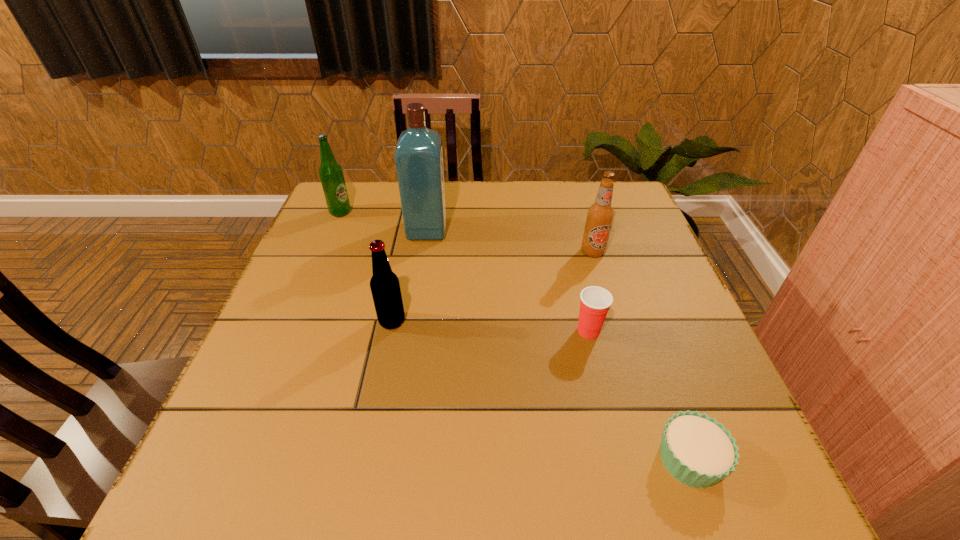
Identify the location of object that ranks as the second closest to the rightmost beer bottle. The height and width of the screenshot is (540, 960). (419, 153).

Locate which beer bottle ranks second in proximity to the rightmost beer bottle. Please provide its 2D coordinates. Your answer should be formatted as a tuple, i.e. [(x, y)], where the tuple contains the x and y coordinates of a point satisfying the conditions above.

[(331, 175)]

Choose which beer bottle is the second nearest neighbor to the cupcake. Please provide its 2D coordinates. Your answer should be formatted as a tuple, i.e. [(x, y)], where the tuple contains the x and y coordinates of a point satisfying the conditions above.

[(385, 288)]

The width and height of the screenshot is (960, 540). Identify the location of free region that satisfies the following two spatial constraints: 1. on the back side of the nearest object; 2. on the flat label side of the tallest object. 607,230.

This screenshot has width=960, height=540. Find the location of `free spot that satisfies the following two spatial constraints: 1. on the label of the farthest beer bottle; 2. on the right side of the nearest object`. free spot that satisfies the following two spatial constraints: 1. on the label of the farthest beer bottle; 2. on the right side of the nearest object is located at coordinates (237, 459).

Find the location of a particular element. The width and height of the screenshot is (960, 540). vacant area in the image that satisfies the following two spatial constraints: 1. on the flat label side of the tallest object; 2. on the back side of the Dixie cup is located at coordinates (412, 331).

I want to click on vacant space that satisfies the following two spatial constraints: 1. on the label of the cupcake; 2. on the left side of the farthest object, so click(237, 459).

Where is `vacant area that satisfies the following two spatial constraints: 1. on the front side of the nearest object; 2. on the left side of the nearest beer bottle`? This screenshot has width=960, height=540. vacant area that satisfies the following two spatial constraints: 1. on the front side of the nearest object; 2. on the left side of the nearest beer bottle is located at coordinates (365, 459).

The image size is (960, 540). Find the location of `vacant area that satisfies the following two spatial constraints: 1. on the label of the shortest object; 2. on the right side of the leftmost object`. vacant area that satisfies the following two spatial constraints: 1. on the label of the shortest object; 2. on the right side of the leftmost object is located at coordinates (237, 459).